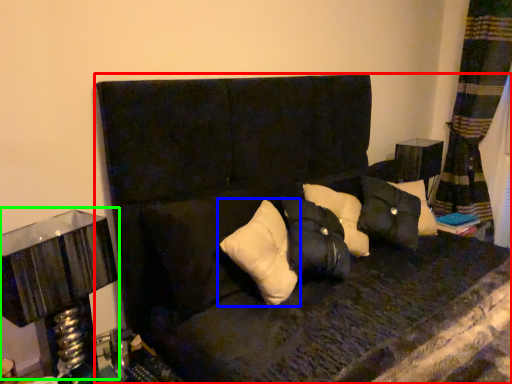
Question: Which is farther away from furniture (highlighted by a red box)? pillow (highlighted by a blue box) or table lamp (highlighted by a green box)?

Choices:
 (A) pillow
 (B) table lamp

Answer: (B)